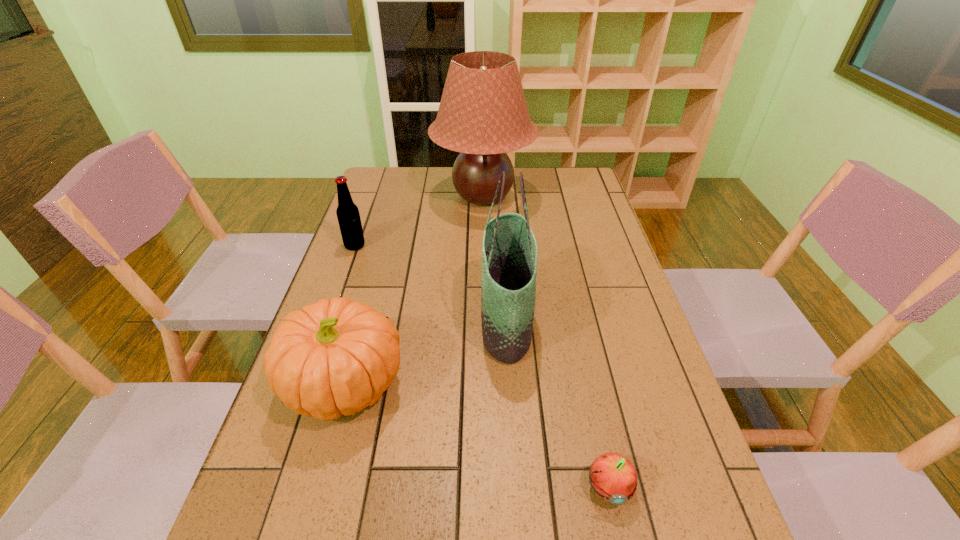
Point out which object is positioned as the second nearest to the apple. Please provide its 2D coordinates. Your answer should be formatted as a tuple, i.e. [(x, y)], where the tuple contains the x and y coordinates of a point satisfying the conditions above.

[(337, 356)]

Choose which object is the second nearest neighbor to the apple. Please provide its 2D coordinates. Your answer should be formatted as a tuple, i.e. [(x, y)], where the tuple contains the x and y coordinates of a point satisfying the conditions above.

[(337, 356)]

In order to click on vacant space that satisfies the following two spatial constraints: 1. on the surface of the apple; 2. on the left side of the pumpkin in this screenshot , I will do `click(319, 487)`.

Identify the location of free space that satisfies the following two spatial constraints: 1. on the surface of the pumpkin; 2. on the back side of the nearest object. This screenshot has height=540, width=960. (319, 487).

Locate an element on the screen. The height and width of the screenshot is (540, 960). vacant space that satisfies the following two spatial constraints: 1. on the front-facing side of the tote bag; 2. on the left side of the farthest object is located at coordinates (484, 320).

Where is `free space that satisfies the following two spatial constraints: 1. on the surface of the apple; 2. on the right side of the pumpkin`? free space that satisfies the following two spatial constraints: 1. on the surface of the apple; 2. on the right side of the pumpkin is located at coordinates (319, 487).

Locate an element on the screen. Image resolution: width=960 pixels, height=540 pixels. vacant point that satisfies the following two spatial constraints: 1. on the back side of the shortest object; 2. on the front-facing side of the lampshade is located at coordinates (545, 197).

The width and height of the screenshot is (960, 540). I want to click on free space that satisfies the following two spatial constraints: 1. on the back side of the shortest object; 2. on the front-facing side of the lampshade, so click(545, 197).